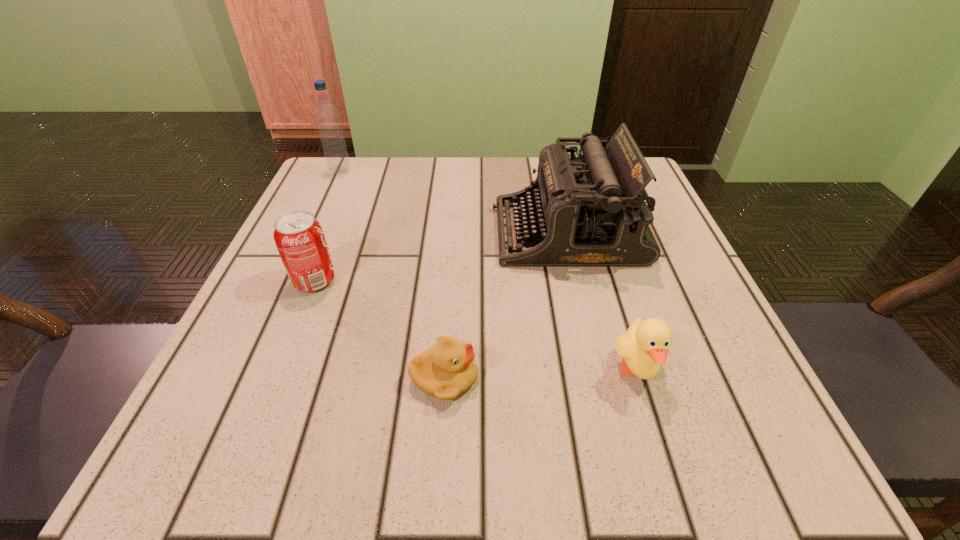
At what (x,y) coordinates should I click in order to perform the action: click on duckling that is at the right edge. Please return your answer as a coordinate pair (x, y). The width and height of the screenshot is (960, 540). Looking at the image, I should click on (645, 345).

Identify the location of object that is at the far left corner. This screenshot has width=960, height=540. (327, 116).

You are a GUI agent. You are given a task and a screenshot of the screen. Output one action in this format:
    pyautogui.click(x=<x>, y=<y>)
    Task: Click on the object at the far right corner
    This screenshot has height=540, width=960.
    Given the screenshot: What is the action you would take?
    pyautogui.click(x=589, y=211)

Where is `vacant region at the far edge of the desktop`? vacant region at the far edge of the desktop is located at coordinates (384, 185).

The image size is (960, 540). Find the location of `vacant space at the near edge`. vacant space at the near edge is located at coordinates (397, 435).

The image size is (960, 540). In order to click on free space at the left edge in this screenshot , I will do `click(276, 325)`.

This screenshot has height=540, width=960. What are the coordinates of `vacant space at the right edge` in the screenshot? It's located at (619, 310).

Find the location of a particular element. This screenshot has height=540, width=960. free region at the far left corner is located at coordinates (359, 207).

Find the location of a particular element. The width and height of the screenshot is (960, 540). vacant point at the near left corner is located at coordinates point(263,433).

Where is `vacant space at the near right corner of the desktop`? vacant space at the near right corner of the desktop is located at coordinates (765, 459).